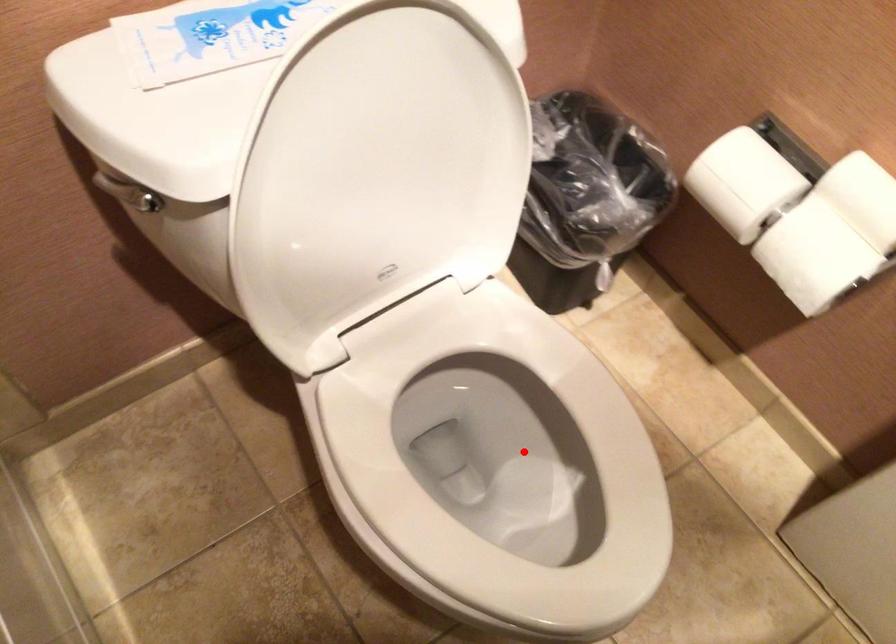
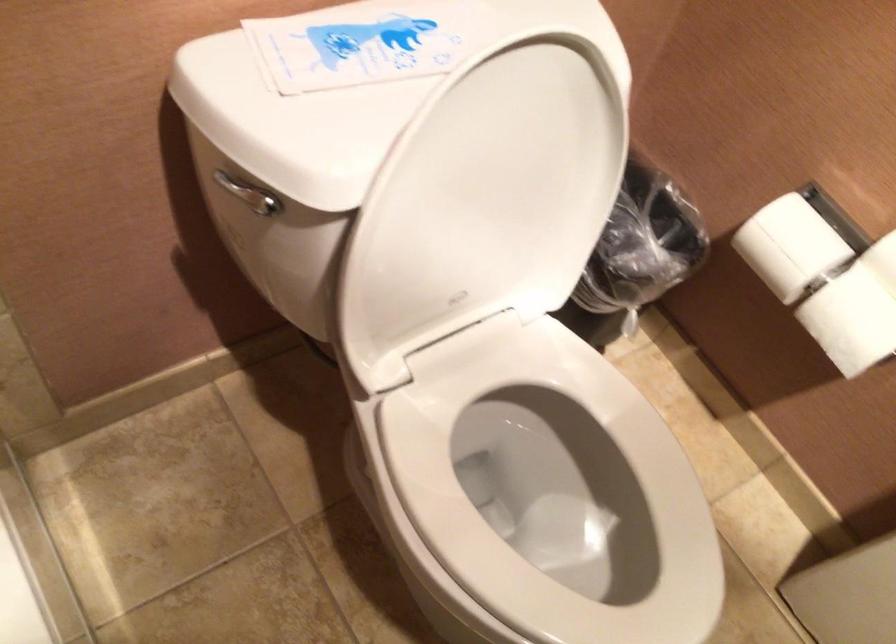
Question: I am providing you with two images of the same scene from different viewpoints. A red point is marked on the first image. Is the red point's position out of view in image 2?

Choices:
 (A) Yes
 (B) No

Answer: (B)